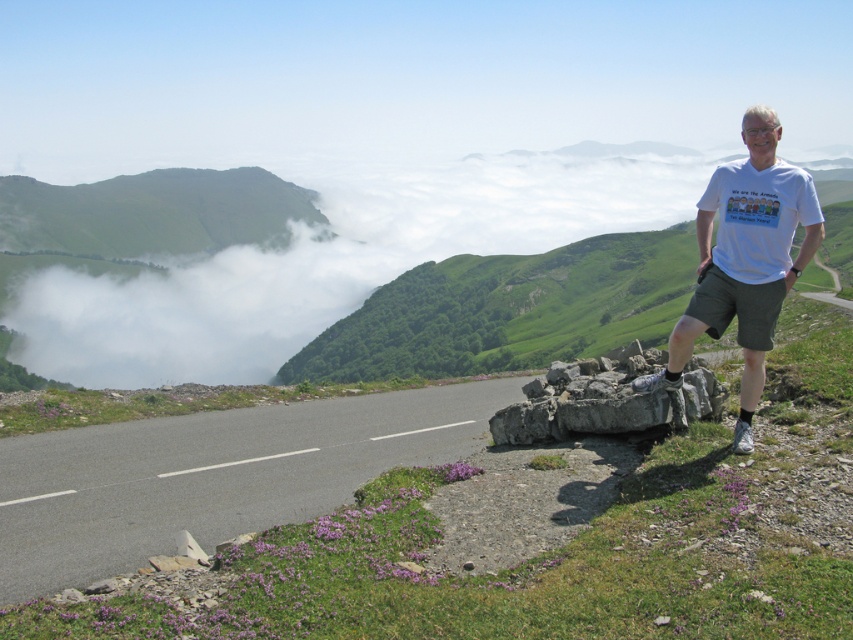
Question: Which object appears closest to the camera in this image?

Choices:
 (A) asphalt road at lower left
 (B) gray rough rock at right
 (C) white t-shirt at upper right

Answer: (C)

Question: Can you confirm if asphalt road at lower left is smaller than white t-shirt at upper right?

Choices:
 (A) yes
 (B) no

Answer: (A)

Question: Does asphalt road at lower left appear on the right side of white t-shirt at upper right?

Choices:
 (A) yes
 (B) no

Answer: (B)

Question: Which object appears closest to the camera in this image?

Choices:
 (A) asphalt road at lower left
 (B) white t-shirt at upper right

Answer: (B)

Question: Which point is closer to the camera taking this photo?

Choices:
 (A) (41, 486)
 (B) (722, 400)

Answer: (B)

Question: Is white t-shirt at upper right wider than gray rough rock at right?

Choices:
 (A) no
 (B) yes

Answer: (B)